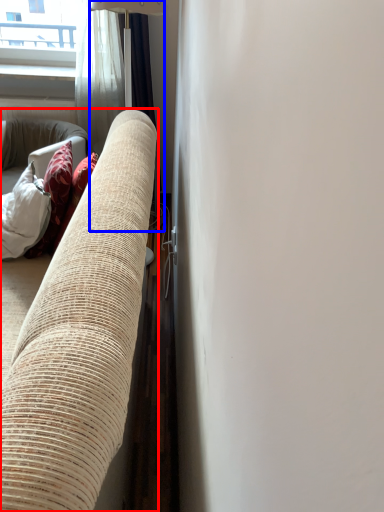
Question: Which of the following is the closest to the observer, studio couch (highlighted by a red box) or curtain (highlighted by a blue box)?

Choices:
 (A) studio couch
 (B) curtain

Answer: (A)